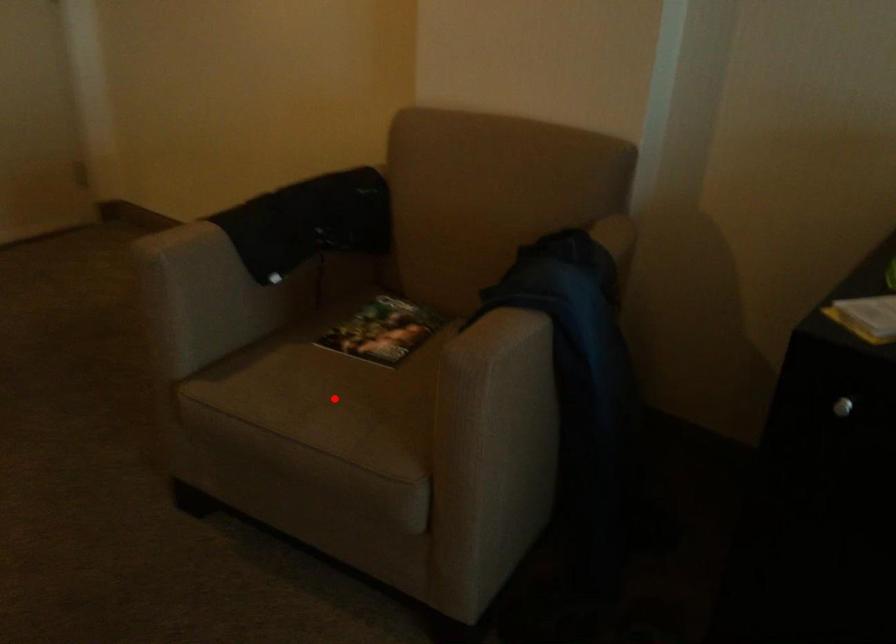
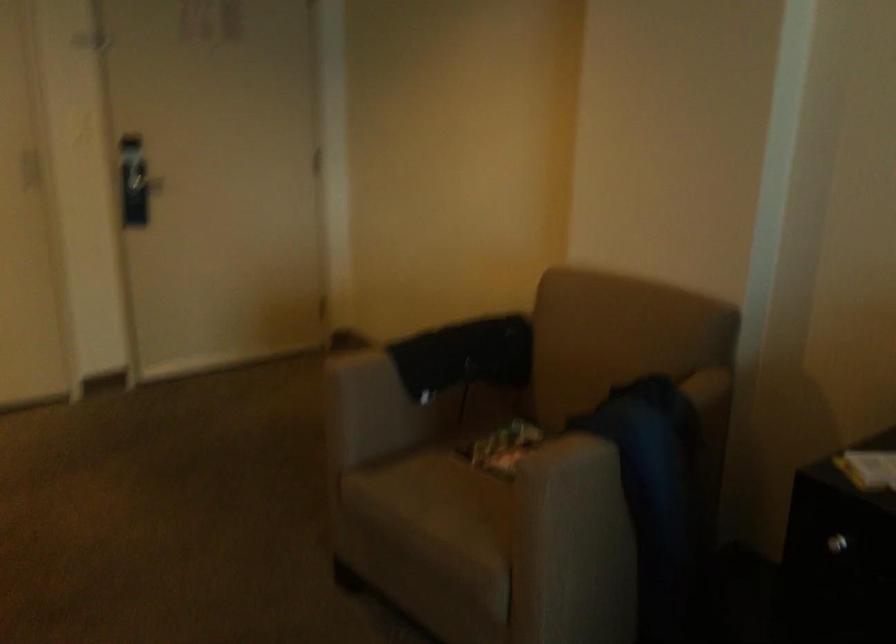
Question: I am providing you with two images of the same scene from different viewpoints. Image1 has a red point marked. In image2, the corresponding 3D location appears at what relative position? Reply with the corresponding letter.

Choices:
 (A) Closer
 (B) Farther

Answer: (B)